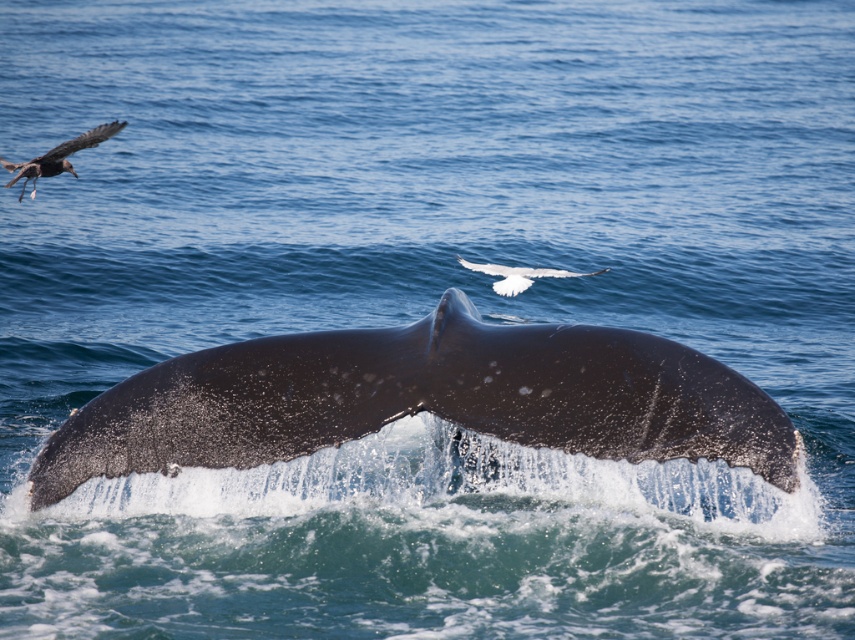
You are a marine biologist observing the whale breaching scene. You notice two birds in the image. Which bird is larger in size between the shiny black bird at upper left and the white feathered bird at upper center?

The shiny black bird at upper left is bigger than the white feathered bird at upper center.

You are a marine biologist observing the whale breaching. You notice the dark gray textured tail fin at center and the shiny black bird at upper left. Which object is located to the right of the other?

The dark gray textured tail fin at center is positioned on the right side of shiny black bird at upper left.

You are a birdwatcher observing the scene. You notice the dark gray textured tail fin at center and the white feathered bird at upper center. Which object is positioned more to the right in the image?

The white feathered bird at upper center is positioned more to the right than the dark gray textured tail fin at center.